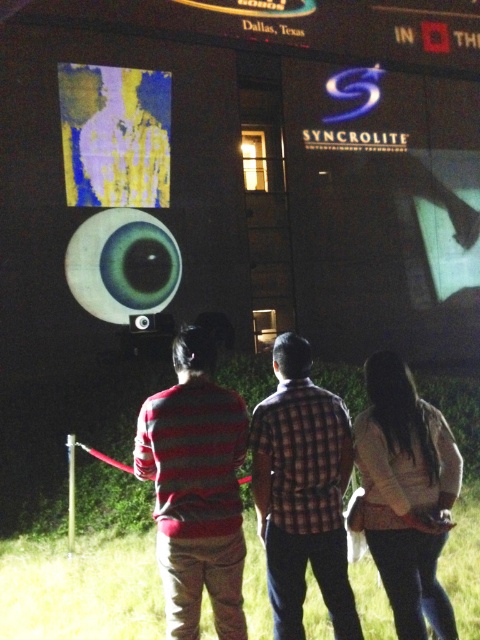
In the scene shown: Can you confirm if plaid shirt at center is taller than yellow fabric screen at upper left?

No.

This screenshot has height=640, width=480. Describe the element at coordinates (302, 492) in the screenshot. I see `plaid shirt at center` at that location.

Who is more forward, (x=288, y=362) or (x=148, y=77)?

Point (x=288, y=362) is more forward.

The width and height of the screenshot is (480, 640). Identify the location of plaid shirt at center. (302, 492).

Between white matte shirt at center and matte black speaker at center, which one is positioned higher?

matte black speaker at center is above.

Is point (394, 420) less distant than point (131, 328)?

Yes, it is.

Find the location of `white matte shirt at center`. white matte shirt at center is located at coordinates (407, 493).

Who is more distant from viewer, (229, 579) or (361, 468)?

The point (361, 468) is more distant.

Does striped sweater at center have a lesser width compared to white matte shirt at center?

Yes, striped sweater at center is thinner than white matte shirt at center.

Is point (181, 492) less distant than point (399, 513)?

Yes, it is in front of point (399, 513).

Find the location of `striped sweater at center`. striped sweater at center is located at coordinates (195, 488).